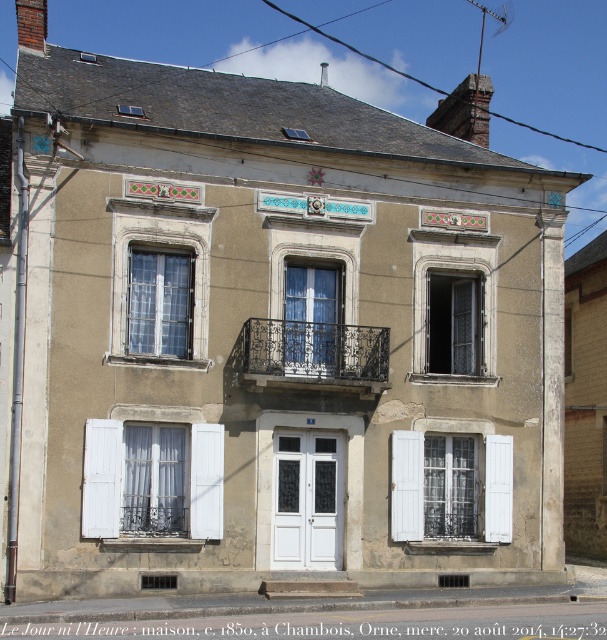
Who is shorter, white wood shutter at lower left or white wooden shutter at lower center?

Standing shorter between the two is white wood shutter at lower left.

Can you confirm if white wood shutter at lower left is positioned to the left of white wooden shutter at lower center?

Correct, you'll find white wood shutter at lower left to the left of white wooden shutter at lower center.

What do you see at coordinates (132, 477) in the screenshot?
I see `white wood shutter at lower left` at bounding box center [132, 477].

At what (x,y) coordinates should I click in order to perform the action: click on white wood shutter at lower left. Please return your answer as a coordinate pair (x, y). This screenshot has width=607, height=640. Looking at the image, I should click on (132, 477).

Between white wood shutter at lower left and white painted wood at center, which one is positioned higher?

Positioned higher is white painted wood at center.

Who is more forward, (120, 477) or (287, 292)?

Positioned in front is point (120, 477).

Which is behind, point (135, 504) or point (319, 307)?

The point (319, 307) is more distant.

Where is `white wood shutter at lower left`? This screenshot has width=607, height=640. white wood shutter at lower left is located at coordinates (132, 477).

Is white wooden shutter at lower center below wrought iron balcony at center?

Indeed, white wooden shutter at lower center is positioned under wrought iron balcony at center.

Who is shorter, white wooden shutter at lower center or wrought iron balcony at center?

wrought iron balcony at center is shorter.

Identify the location of white wooden shutter at lower center. (430, 484).